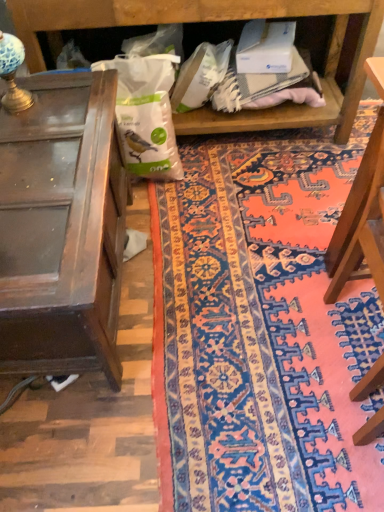
Locate an element on the screen. The width and height of the screenshot is (384, 512). vacant space to the right of wooden table at left is located at coordinates (234, 272).